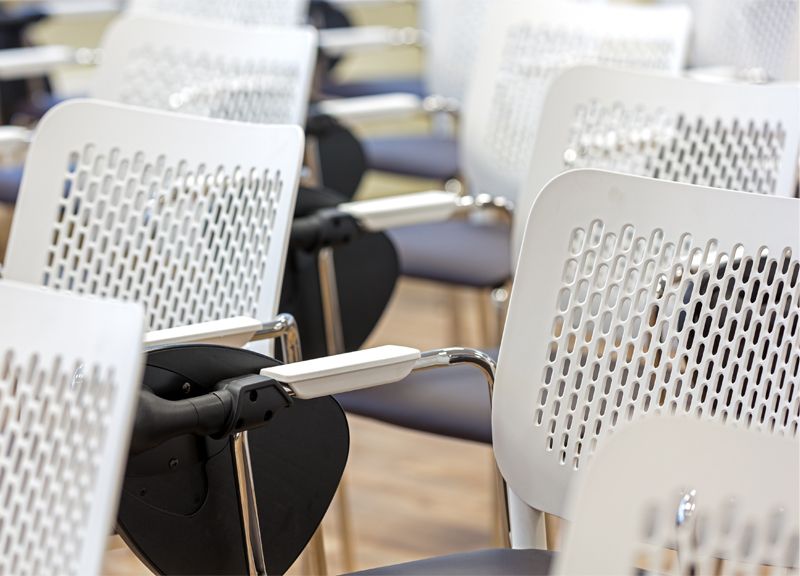
What are the coordinates of `chair seats` in the screenshot? It's located at (493, 562), (448, 416), (462, 255), (413, 155), (396, 86), (46, 102), (13, 178).